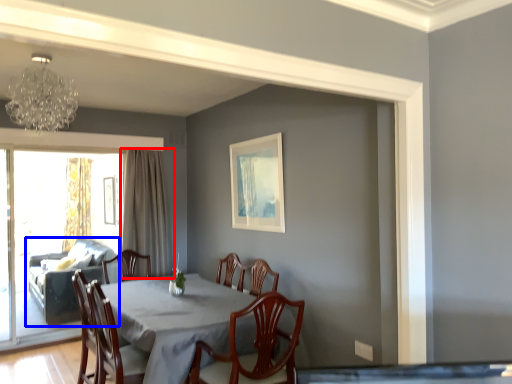
Question: Which point is further to the camera, curtain (highlighted by a red box) or studio couch (highlighted by a blue box)?

Choices:
 (A) curtain
 (B) studio couch

Answer: (B)